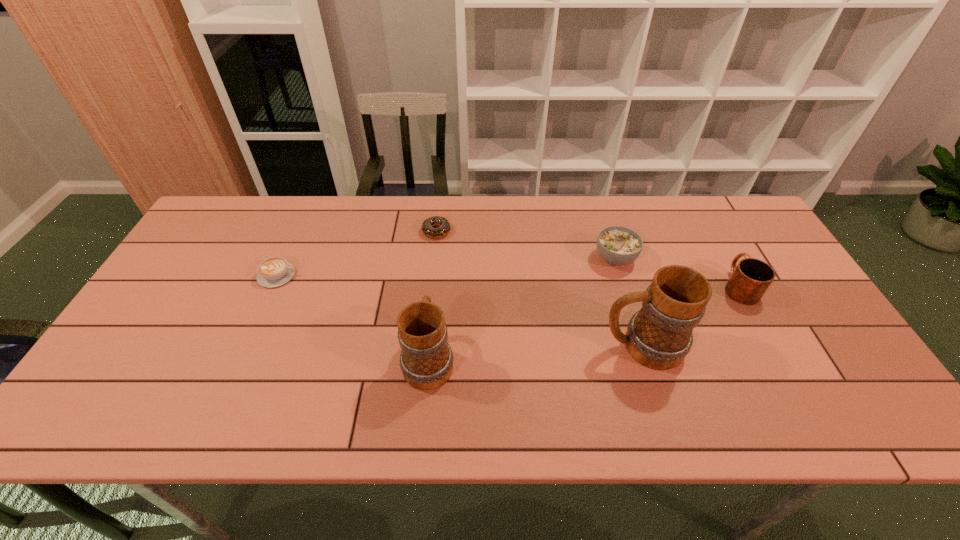
The height and width of the screenshot is (540, 960). Find the location of `free space that satisfies the following two spatial constraints: 1. on the side of the rightmost object with the handle; 2. on the side of the leftmost object with the handle`. free space that satisfies the following two spatial constraints: 1. on the side of the rightmost object with the handle; 2. on the side of the leftmost object with the handle is located at coordinates (732, 275).

Image resolution: width=960 pixels, height=540 pixels. In order to click on free space that satisfies the following two spatial constraints: 1. on the side of the shortest mug with the handle; 2. on the side of the cappuccino with the handle in this screenshot , I will do `click(732, 275)`.